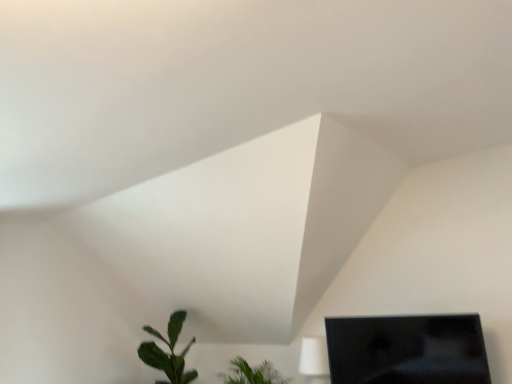
Question: From the image's perspective, is green leafy plant at lower center, acting as the second houseplant starting from the left, below green matte leafy plant at lower left, which is counted as the first houseplant, starting from the left?

Choices:
 (A) no
 (B) yes

Answer: (A)

Question: From a real-world perspective, is green leafy plant at lower center, acting as the second houseplant starting from the left, located higher than green matte leafy plant at lower left, which appears as the 2th houseplant when viewed from the right?

Choices:
 (A) no
 (B) yes

Answer: (A)

Question: Considering the relative sizes of green leafy plant at lower center, the 1th houseplant positioned from the right, and green matte leafy plant at lower left, which appears as the 2th houseplant when viewed from the right, in the image provided, is green leafy plant at lower center, the 1th houseplant positioned from the right, smaller than green matte leafy plant at lower left, which appears as the 2th houseplant when viewed from the right,?

Choices:
 (A) no
 (B) yes

Answer: (B)

Question: Are green leafy plant at lower center, acting as the second houseplant starting from the left, and green matte leafy plant at lower left, which is counted as the first houseplant, starting from the left, located far from each other?

Choices:
 (A) no
 (B) yes

Answer: (A)

Question: Is green leafy plant at lower center, acting as the second houseplant starting from the left, bigger than green matte leafy plant at lower left, which appears as the 2th houseplant when viewed from the right?

Choices:
 (A) no
 (B) yes

Answer: (A)

Question: Can you confirm if green leafy plant at lower center, acting as the second houseplant starting from the left, is wider than green matte leafy plant at lower left, which is counted as the first houseplant, starting from the left?

Choices:
 (A) yes
 (B) no

Answer: (A)

Question: Considering the relative positions of green matte leafy plant at lower left, which is counted as the first houseplant, starting from the left, and green leafy plant at lower center, the 1th houseplant positioned from the right, in the image provided, is green matte leafy plant at lower left, which is counted as the first houseplant, starting from the left, to the right of green leafy plant at lower center, the 1th houseplant positioned from the right, from the viewer's perspective?

Choices:
 (A) no
 (B) yes

Answer: (A)

Question: Is green matte leafy plant at lower left, which is counted as the first houseplant, starting from the left, shorter than green leafy plant at lower center, the 1th houseplant positioned from the right?

Choices:
 (A) no
 (B) yes

Answer: (A)

Question: Is green matte leafy plant at lower left, which is counted as the first houseplant, starting from the left, beside green leafy plant at lower center, acting as the second houseplant starting from the left?

Choices:
 (A) no
 (B) yes

Answer: (A)

Question: Can green leafy plant at lower center, acting as the second houseplant starting from the left, be found inside green matte leafy plant at lower left, which is counted as the first houseplant, starting from the left?

Choices:
 (A) no
 (B) yes

Answer: (A)

Question: Is green matte leafy plant at lower left, which appears as the 2th houseplant when viewed from the right, facing towards green leafy plant at lower center, acting as the second houseplant starting from the left?

Choices:
 (A) yes
 (B) no

Answer: (B)

Question: Can you confirm if green matte leafy plant at lower left, which appears as the 2th houseplant when viewed from the right, is taller than green leafy plant at lower center, acting as the second houseplant starting from the left?

Choices:
 (A) yes
 (B) no

Answer: (A)

Question: Can you confirm if black glossy monitor at lower right is thinner than green matte leafy plant at lower left, which appears as the 2th houseplant when viewed from the right?

Choices:
 (A) yes
 (B) no

Answer: (A)